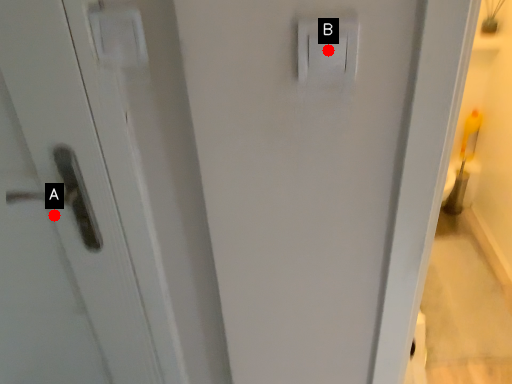
Question: Two points are circled on the image, labeled by A and B beside each circle. Which point is further to the camera?

Choices:
 (A) A is further
 (B) B is further

Answer: (A)